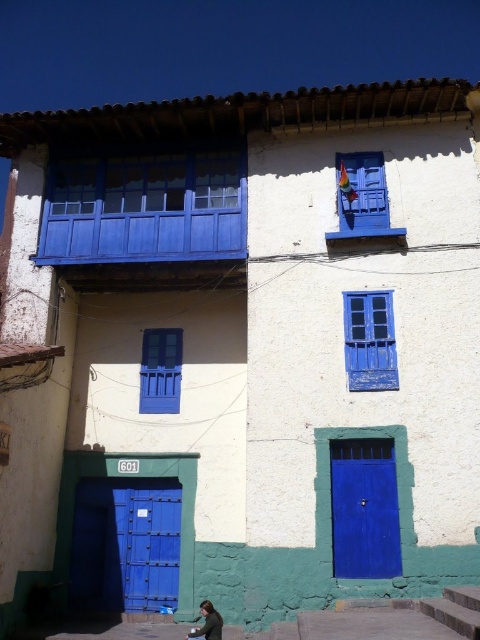
You are standing at the camera position looking at the two story building. There is a point at coordinates point (205, 259). Can you determine if this point is closer to the camera than 15 meters?

The distance between point (205, 259) and the camera is 13.07 meters, which is less than 15 meters. Therefore, the point is closer than 15 meters.

You are standing at point (364, 189) and want to move to point (137, 506). Is the path blocked by any part of the building?

The path between point (364, 189) and point (137, 506) is blocked by the building because point (137, 506) is behind point (364, 189), meaning the building is in the way.